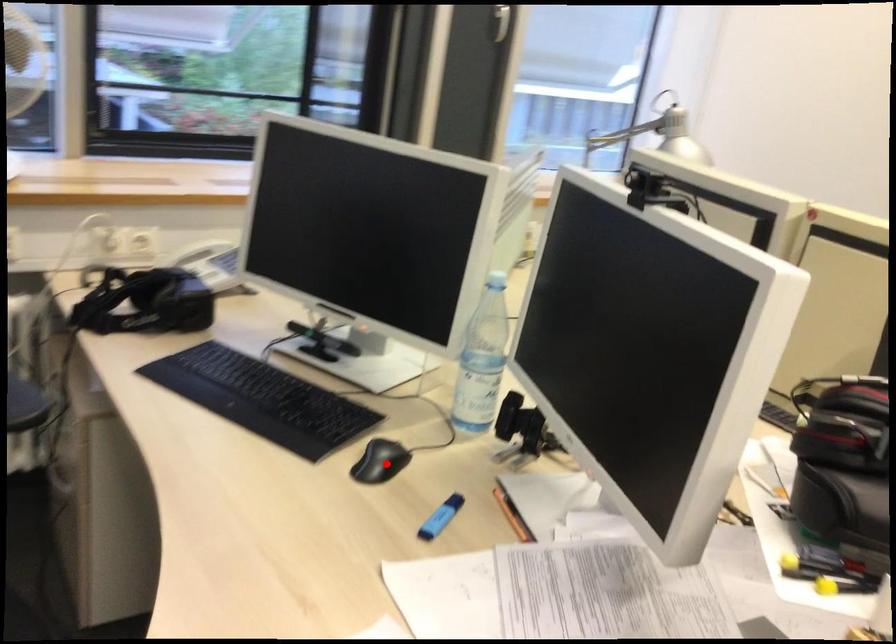
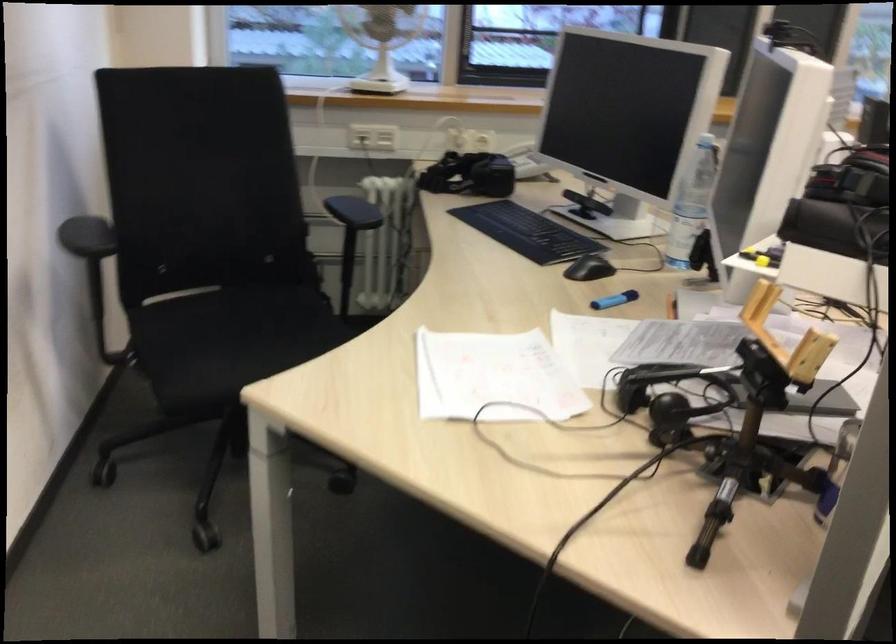
Question: I am providing you with two images of the same scene from different viewpoints. A red point is shown in image1. For the corresponding object point in image2, is it positioned nearer or farther from the camera?

Choices:
 (A) Nearer
 (B) Farther

Answer: (B)